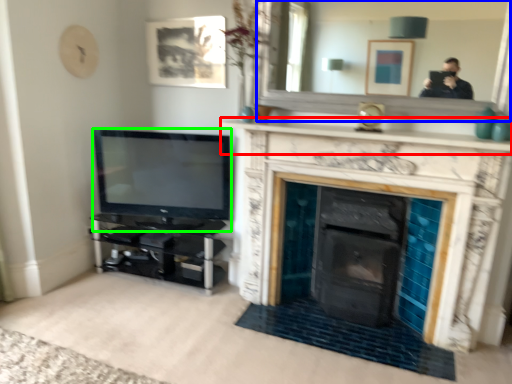
Question: Which is nearer to the mantle (highlighted by a red box)? mirror (highlighted by a blue box) or television (highlighted by a green box).

Choices:
 (A) mirror
 (B) television

Answer: (B)